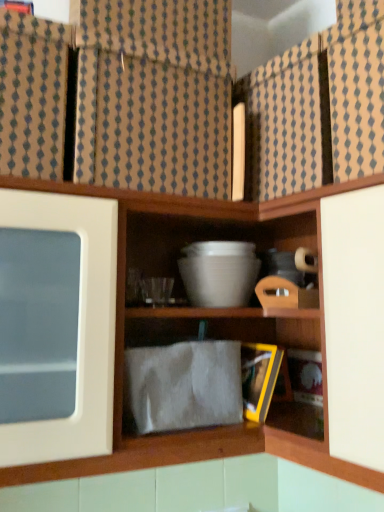
Question: Is white matte bowl at upper center at the back of brown textured fabric at upper center?

Choices:
 (A) yes
 (B) no

Answer: (B)

Question: From a real-world perspective, is brown textured fabric at upper center on white matte bowl at upper center?

Choices:
 (A) no
 (B) yes

Answer: (B)

Question: From a real-world perspective, is brown textured fabric at upper center positioned under white matte bowl at upper center based on gravity?

Choices:
 (A) no
 (B) yes

Answer: (A)

Question: Would you say brown textured fabric at upper center contains white matte bowl at upper center?

Choices:
 (A) yes
 (B) no

Answer: (B)

Question: Does brown textured fabric at upper center turn towards white matte bowl at upper center?

Choices:
 (A) yes
 (B) no

Answer: (B)

Question: Would you say white glossy mixing bowl at center is to the left or to the right of white matte bowl at upper center in the picture?

Choices:
 (A) right
 (B) left

Answer: (B)

Question: Considering the positions of white glossy mixing bowl at center and white matte bowl at upper center in the image, is white glossy mixing bowl at center wider or thinner than white matte bowl at upper center?

Choices:
 (A) wide
 (B) thin

Answer: (B)

Question: Is white glossy mixing bowl at center in front of or behind white matte bowl at upper center in the image?

Choices:
 (A) behind
 (B) front

Answer: (A)

Question: Considering the positions of point (213, 245) and point (324, 163), is point (213, 245) closer or farther from the camera than point (324, 163)?

Choices:
 (A) closer
 (B) farther

Answer: (B)

Question: From a real-world perspective, is brown textured fabric at upper center physically located above or below white matte bowl at upper center?

Choices:
 (A) above
 (B) below

Answer: (A)

Question: From their relative heights in the image, would you say brown textured fabric at upper center is taller or shorter than white matte bowl at upper center?

Choices:
 (A) short
 (B) tall

Answer: (A)

Question: Is point (230, 177) closer or farther from the camera than point (349, 30)?

Choices:
 (A) closer
 (B) farther

Answer: (B)

Question: In terms of width, does brown textured fabric at upper center look wider or thinner when compared to white matte bowl at upper center?

Choices:
 (A) thin
 (B) wide

Answer: (A)

Question: Considering their positions, is white matte bowl at upper center located in front of or behind brown textured fabric at upper center?

Choices:
 (A) behind
 (B) front

Answer: (A)

Question: From the image's perspective, is white matte bowl at upper center located above or below brown textured fabric at upper center?

Choices:
 (A) above
 (B) below

Answer: (B)